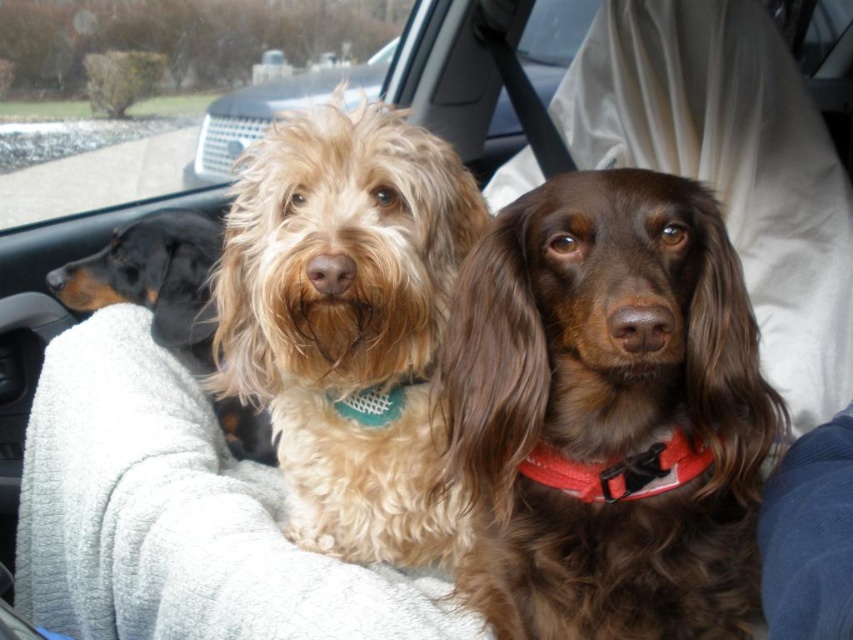
You are a photographer trying to capture a clear photo of the brown shaggy dog at center. The camera requires the subject to be at least 24 inches away for optimal focus. Can you take the photo without moving the dog?

The brown shaggy dog at center is 24.19 inches from the camera, which meets the minimum distance requirement of 24 inches. Therefore, the photographer can take the photo without moving the dog.

You are a delivery robot with a 60 cm wide package. You need to pass between the transparent glass window at upper center and the black smooth dachshund at left to reach the delivery spot. Can you fit through the space between them?

The transparent glass window at upper center and the black smooth dachshund at left are 65.66 centimeters apart from each other. Since the package is 60 cm wide, it can fit through the space between them as the distance is wider than the package.